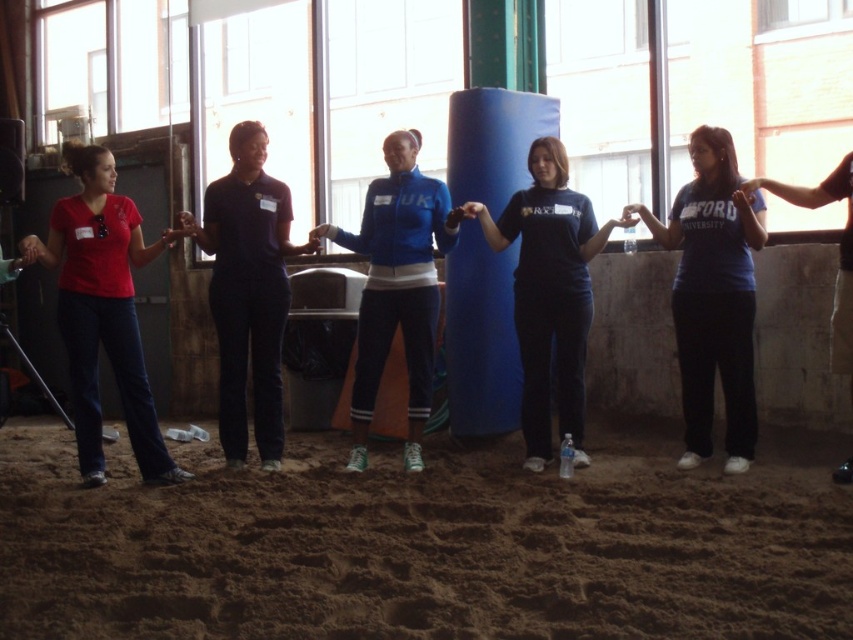
Question: Estimate the real-world distances between objects in this image. Which object is closer to the matte red shirt at left?

Choices:
 (A) brown sandy ground at lower center
 (B) matte blue jacket at center
 (C) dark blue t-shirt at center

Answer: (A)

Question: Where is blue matte jacket at center located in relation to matte blue jacket at center in the image?

Choices:
 (A) left
 (B) right

Answer: (B)

Question: Which point appears closest to the camera in this image?

Choices:
 (A) (405, 260)
 (B) (183, 216)
 (C) (322, 225)
 (D) (132, 332)

Answer: (D)

Question: Is matte red shirt at left positioned at the back of dark blue t-shirt at center?

Choices:
 (A) no
 (B) yes

Answer: (A)

Question: Among these points, which one is nearest to the camera?

Choices:
 (A) (515, 464)
 (B) (544, 316)
 (C) (90, 282)

Answer: (C)

Question: Is matte black hand at center bigger than matte blue jacket at center?

Choices:
 (A) yes
 (B) no

Answer: (B)